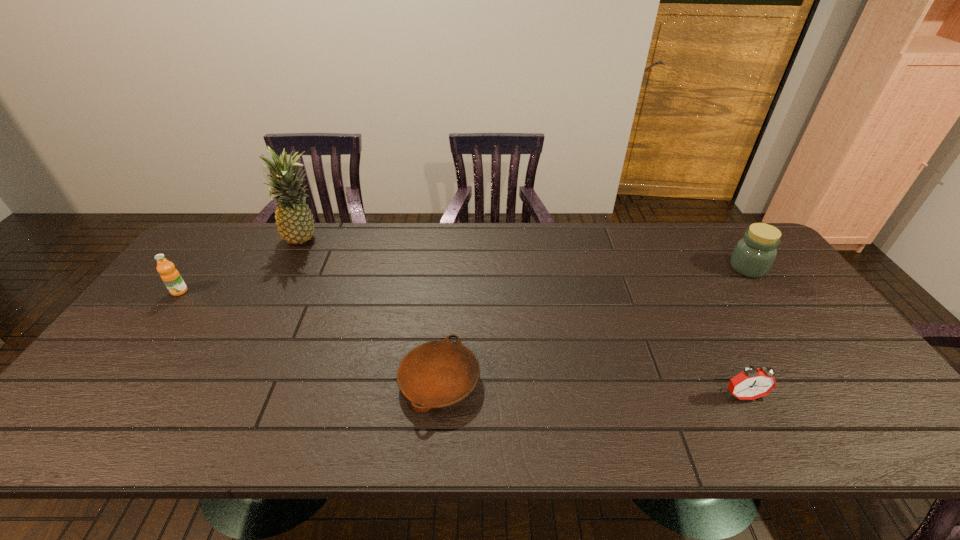
Identify the location of the farthest object. Image resolution: width=960 pixels, height=540 pixels. (294, 220).

Locate an element on the screen. Image resolution: width=960 pixels, height=540 pixels. pineapple is located at coordinates (294, 220).

Identify the location of the second farthest object. (753, 256).

At what (x,y) coordinates should I click in order to perform the action: click on the rightmost object. Please return your answer as a coordinate pair (x, y). Looking at the image, I should click on (753, 256).

Locate an element on the screen. the leftmost object is located at coordinates (171, 277).

You are a GUI agent. You are given a task and a screenshot of the screen. Output one action in this format:
    pyautogui.click(x=<x>, y=<y>)
    Task: Click on the orange juice
    
    Given the screenshot: What is the action you would take?
    pyautogui.click(x=171, y=277)

You are a GUI agent. You are given a task and a screenshot of the screen. Output one action in this format:
    pyautogui.click(x=<x>, y=<y>)
    Task: Click on the fourth object from left to right
    This screenshot has width=960, height=540.
    Given the screenshot: What is the action you would take?
    pyautogui.click(x=752, y=383)

Identify the location of alarm clock. The image size is (960, 540). pos(752,383).

Where is `plate`? This screenshot has width=960, height=540. plate is located at coordinates (436, 374).

Identify the location of the third object from left to right. The image size is (960, 540). (436, 374).